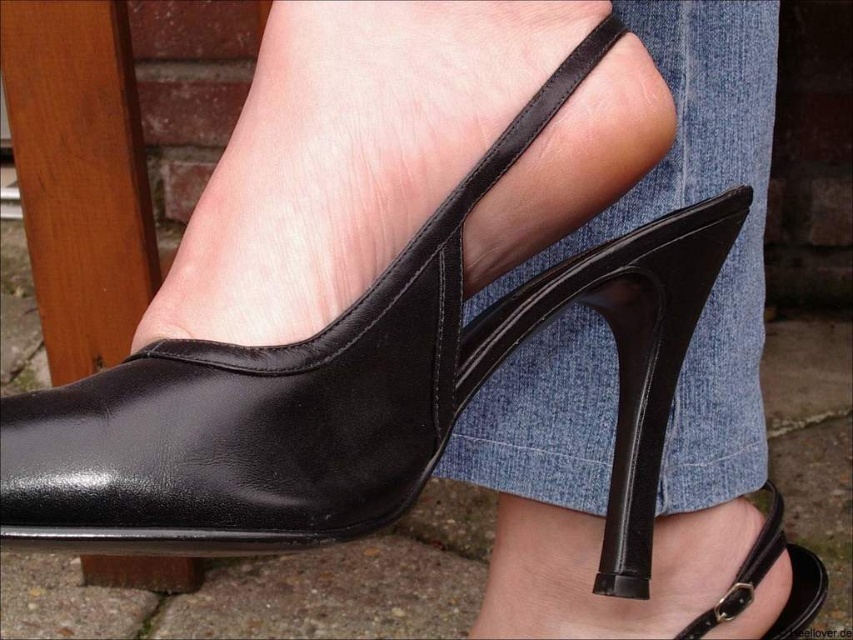
Question: Which point is closer to the camera?

Choices:
 (A) black leather shoe at center
 (B) black leather high-heeled shoe at center

Answer: (A)

Question: Where is black leather shoe at center located in relation to black leather high-heeled shoe at center in the image?

Choices:
 (A) left
 (B) right

Answer: (A)

Question: Which of the following is the closest to the observer?

Choices:
 (A) (444, 384)
 (B) (805, 556)

Answer: (A)

Question: Is black leather shoe at center positioned behind black leather high-heeled shoe at center?

Choices:
 (A) yes
 (B) no

Answer: (B)

Question: Which point appears farthest from the camera in this image?

Choices:
 (A) (709, 508)
 (B) (241, 433)

Answer: (A)

Question: Is black leather shoe at center above black leather high-heeled shoe at center?

Choices:
 (A) no
 (B) yes

Answer: (B)